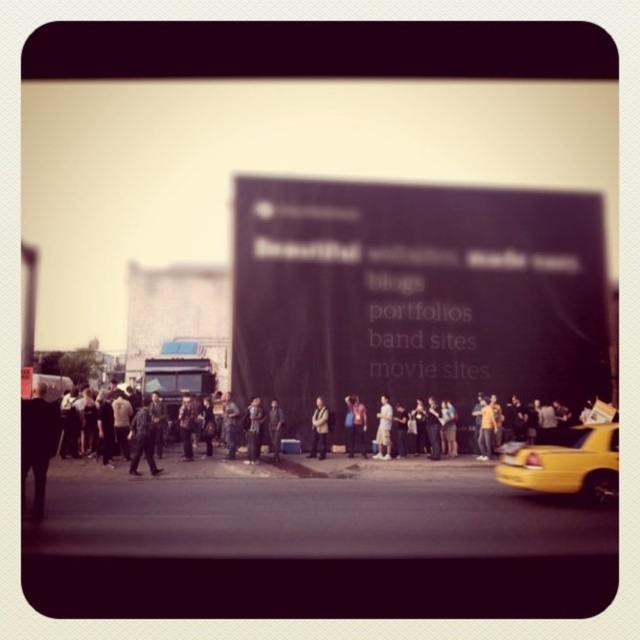
Question: Observing the image, what is the correct spatial positioning of yellow matte taxi at lower right in reference to dark gray sweater at center?

Choices:
 (A) below
 (B) above

Answer: (A)

Question: Is dark gray suit at left further to camera compared to light brown leather jacket at center?

Choices:
 (A) no
 (B) yes

Answer: (A)

Question: Which point is closer to the camera?

Choices:
 (A) (486, 440)
 (B) (348, 404)

Answer: (B)

Question: Which point is closer to the camera?

Choices:
 (A) (321, 413)
 (B) (141, 400)
 (C) (49, 419)

Answer: (C)

Question: Which of these objects is positioned farthest from the dark gray suit at left?

Choices:
 (A) light brown leather jacket at center
 (B) dark gray sweater at center
 (C) yellow t-shirt at center
 (D) dark gray pants at center

Answer: (C)

Question: Can you confirm if black matte billboard at center is bigger than yellow matte taxi at lower right?

Choices:
 (A) no
 (B) yes

Answer: (B)